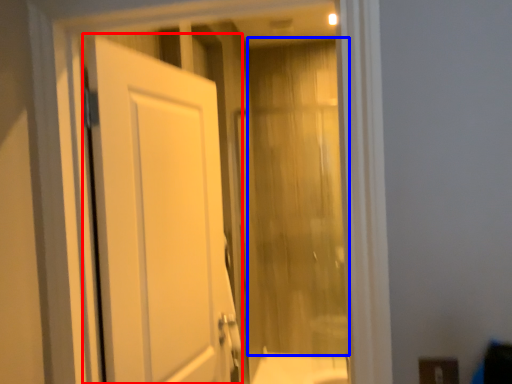
Question: Which point is further to the camera, door (highlighted by a red box) or curtain (highlighted by a blue box)?

Choices:
 (A) door
 (B) curtain

Answer: (B)